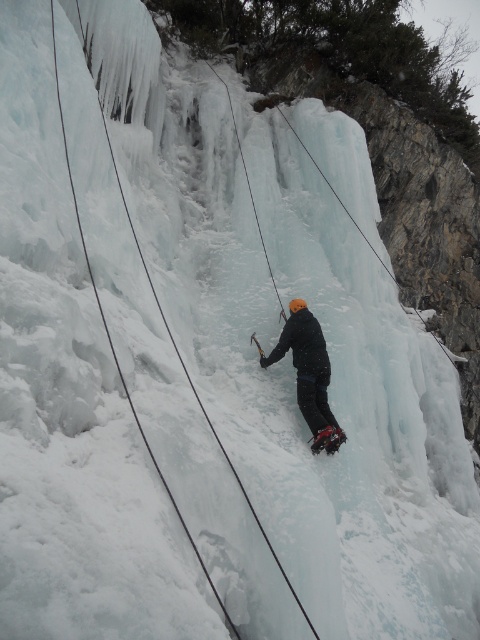
Question: Which point is closer to the camera taking this photo?

Choices:
 (A) (305, 612)
 (B) (298, 396)

Answer: (A)

Question: Which of the following is the farthest from the observer?

Choices:
 (A) (303, 339)
 (B) (141, 424)

Answer: (A)

Question: Does matte black jacket at center come in front of black nylon rope at center?

Choices:
 (A) no
 (B) yes

Answer: (A)

Question: Does matte black jacket at center appear over black nylon rope at center?

Choices:
 (A) no
 (B) yes

Answer: (A)

Question: Which object appears closest to the camera in this image?

Choices:
 (A) matte black jacket at center
 (B) black nylon rope at center

Answer: (B)

Question: In this image, where is matte black jacket at center located relative to black nylon rope at center?

Choices:
 (A) above
 (B) below

Answer: (B)